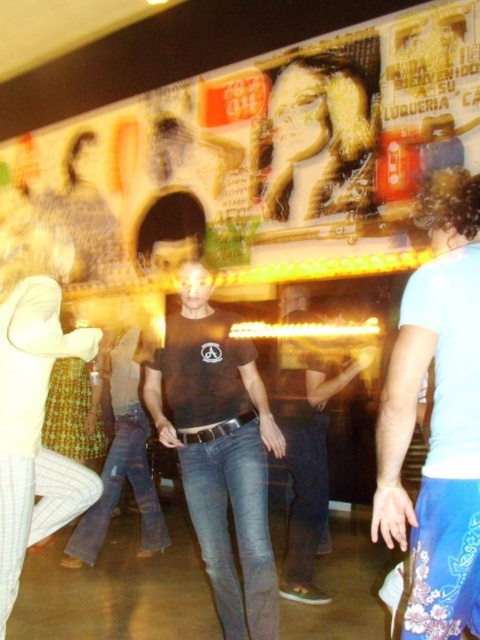
Question: Which point is closer to the camera?

Choices:
 (A) (288, 310)
 (B) (48, 516)
 (C) (361, 128)

Answer: (B)

Question: Among these points, which one is nearest to the camera?

Choices:
 (A) (16, 317)
 (B) (464, 333)
 (C) (304, 467)
 (D) (321, 182)

Answer: (B)

Question: Is the position of matte gold hair at upper center less distant than that of black leather belt at center?

Choices:
 (A) yes
 (B) no

Answer: (B)

Question: Can you confirm if light blue denim jeans at center is bigger than white cotton shirt at center?

Choices:
 (A) no
 (B) yes

Answer: (A)

Question: Which object is positioned closest to the matte gold hair at upper center?

Choices:
 (A) light blue denim jeans at center
 (B) black leather belt at center

Answer: (B)

Question: Does matte gold hair at upper center have a larger size compared to black leather belt at center?

Choices:
 (A) yes
 (B) no

Answer: (B)